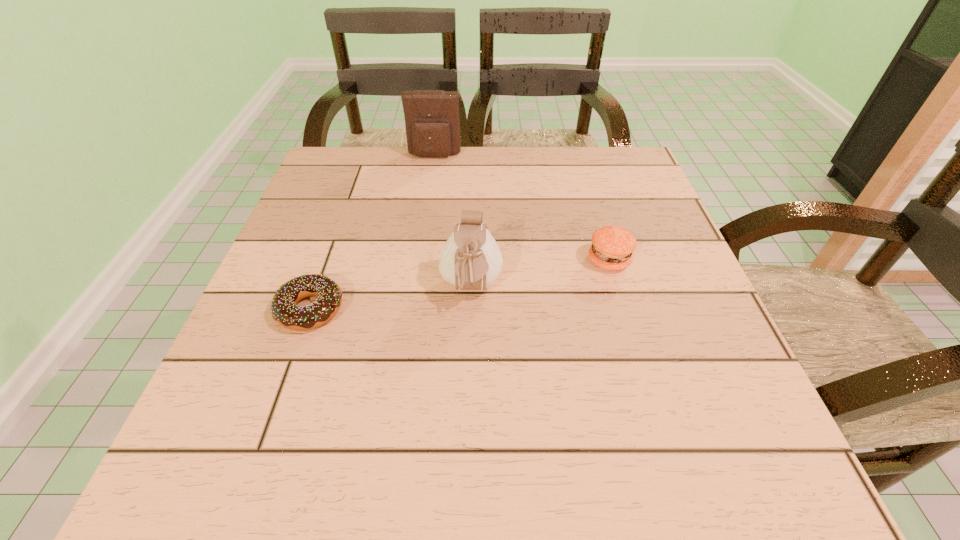
In order to click on object that is at the far edge in this screenshot , I will do `click(432, 122)`.

Find the location of a particular element. The image size is (960, 540). object that is at the left edge is located at coordinates (283, 306).

The width and height of the screenshot is (960, 540). I want to click on object that is at the right edge, so click(x=612, y=246).

You are a GUI agent. You are given a task and a screenshot of the screen. Output one action in this format:
    pyautogui.click(x=<x>, y=<y>)
    Task: Click on the free space at the far edge of the desktop
    This screenshot has width=960, height=540.
    Given the screenshot: What is the action you would take?
    pyautogui.click(x=562, y=191)

Image resolution: width=960 pixels, height=540 pixels. In the image, there is a desktop. Identify the location of vacant space at the near edge. (338, 472).

This screenshot has height=540, width=960. What are the coordinates of `vacant space at the left edge of the desktop` in the screenshot? It's located at (348, 282).

Find the location of a particular element. free space at the right edge of the desktop is located at coordinates click(679, 355).

The width and height of the screenshot is (960, 540). In the image, there is a desktop. Identify the location of vacant space at the far left corner. (388, 154).

Locate an element on the screen. This screenshot has height=540, width=960. free space at the far right corner of the desktop is located at coordinates (598, 181).

Locate an element on the screen. This screenshot has width=960, height=540. blank space at the near right corner of the desktop is located at coordinates (778, 461).